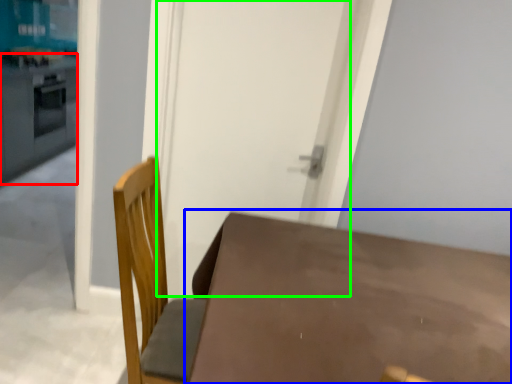
Question: Considering the real-world distances, which object is farthest from counter top (highlighted by a red box)? table (highlighted by a blue box) or screen door (highlighted by a green box)?

Choices:
 (A) table
 (B) screen door

Answer: (A)